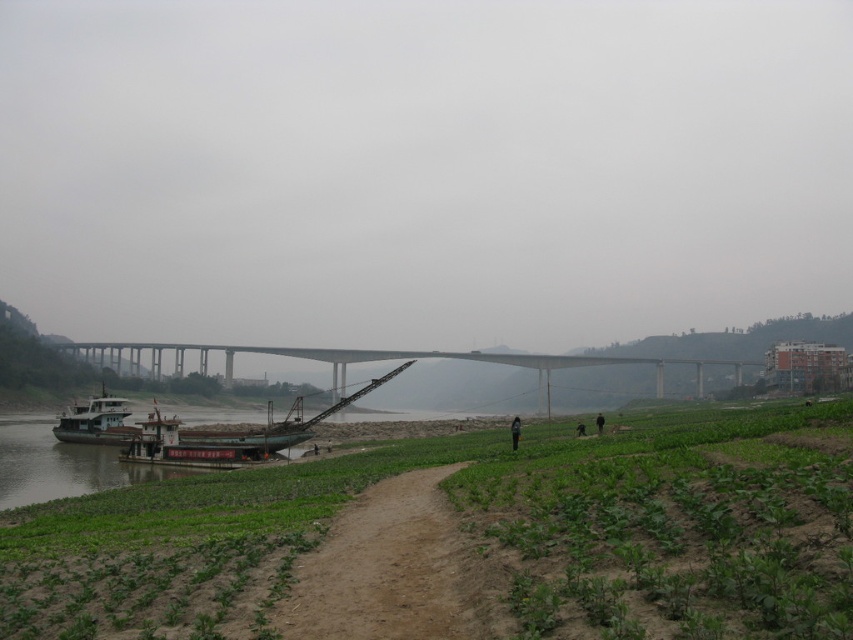
Question: Is green leafy plants at lower left bigger than dirt path at center?

Choices:
 (A) yes
 (B) no

Answer: (A)

Question: Considering the real-world distances, which object is closest to the gray concrete bridge at center?

Choices:
 (A) green leafy plants at lower left
 (B) dirt path at center

Answer: (A)

Question: Can you confirm if dirt path at center is positioned to the right of brown wooden barge at lower left?

Choices:
 (A) yes
 (B) no

Answer: (A)

Question: Which object is positioned farthest from the black fabric person at lower center?

Choices:
 (A) green leafy plants at lower left
 (B) dirt path at center

Answer: (B)

Question: Among these points, which one is farthest from the camera?

Choices:
 (A) (91, 420)
 (B) (412, 476)
 (C) (515, 429)
 (D) (662, 388)

Answer: (D)

Question: Can you confirm if green leafy plants at lower left is wider than white matte boat at left?

Choices:
 (A) yes
 (B) no

Answer: (A)